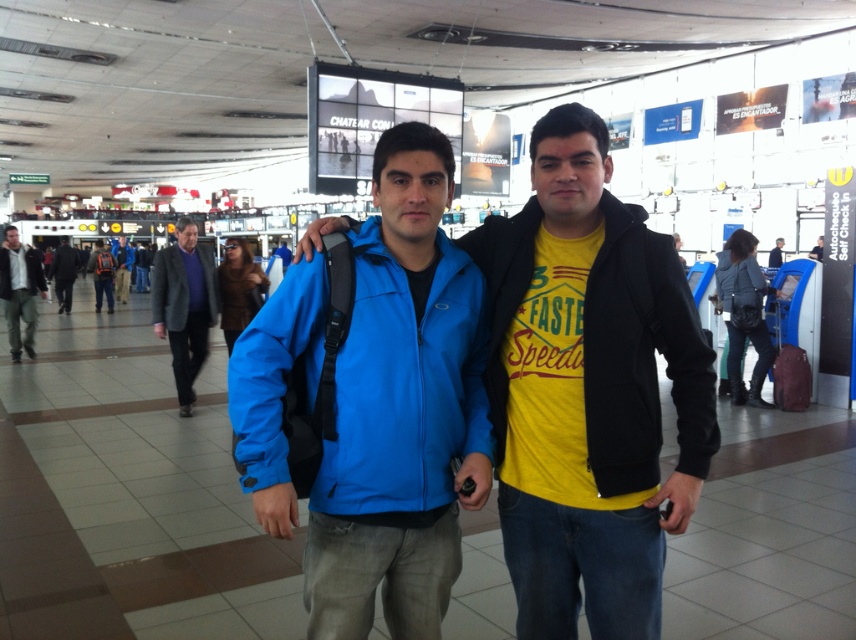
Does black fleece jacket at center have a larger size compared to matte black backpack at center?

Actually, black fleece jacket at center might be smaller than matte black backpack at center.

What are the coordinates of `black fleece jacket at center` in the screenshot? It's located at (643, 353).

Where is `black fleece jacket at center`? black fleece jacket at center is located at coordinates (643, 353).

Who is positioned more to the left, dark gray suit at center or dark gray woolen jacket at center?

From the viewer's perspective, dark gray suit at center appears more on the left side.

Who is more distant from viewer, (x=197, y=317) or (x=183, y=314)?

The point (x=197, y=317) is behind.

What are the coordinates of `dark gray suit at center` in the screenshot? It's located at (183, 307).

Identify the location of black fleece jacket at center. This screenshot has height=640, width=856. (643, 353).

Looking at this image, is black fleece jacket at center to the left of dark gray woolen jacket at center from the viewer's perspective?

Incorrect, black fleece jacket at center is not on the left side of dark gray woolen jacket at center.

What are the coordinates of `black fleece jacket at center` in the screenshot? It's located at (643, 353).